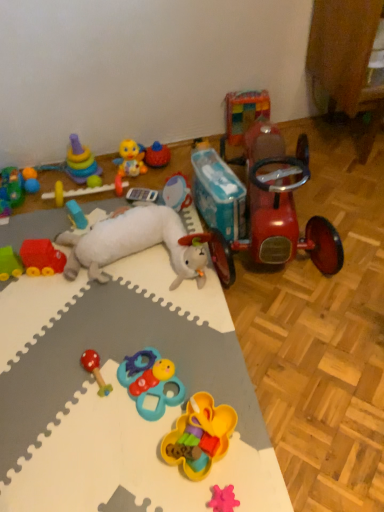
Find the location of a particular element. The height and width of the screenshot is (512, 384). vacant space to the right of blue rubber rattle at center, marked as the 8th toy in a left-to-right arrangement is located at coordinates (219, 365).